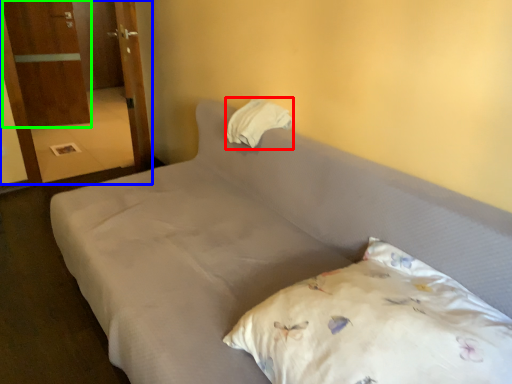
Question: Which is nearer to the pillow (highlighted by a red box)? armoire (highlighted by a blue box) or armoire (highlighted by a green box).

Choices:
 (A) armoire
 (B) armoire

Answer: (A)